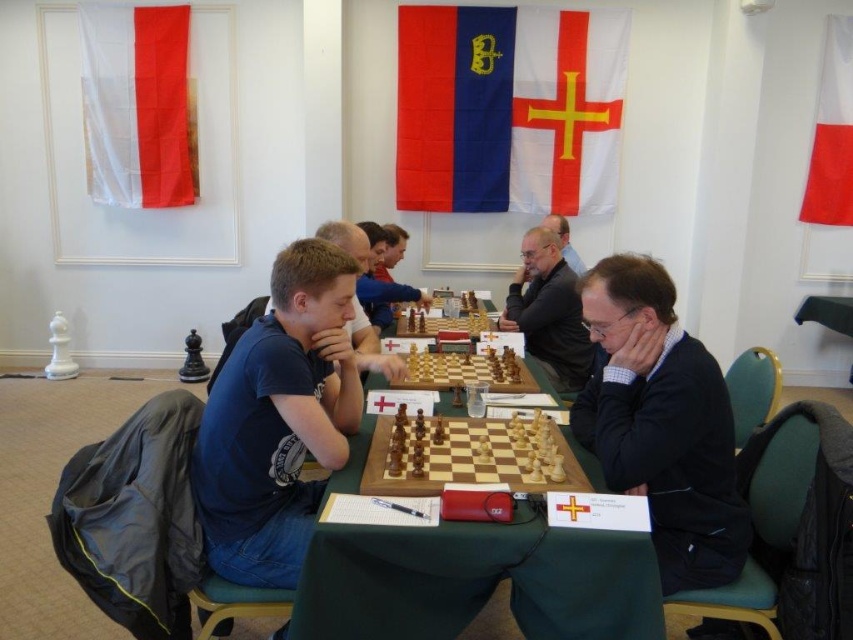
You are organizing a chess tournament and need to place a trophy on the table between the wooden at center and the wooden chessboard at center. Which object should the trophy be placed closer to if it needs to be centered between them?

The trophy should be placed closer to the wooden chessboard at center because the wooden at center is wider than the wooden chessboard at center, so the center point between them would be nearer to the narrower object.

Consider the image. You are a photographer positioned at the back of the room. You want to take a photo of both the black sweater at center and the blue cotton shirt at center without any obstruction. Which one should you focus on first to ensure both are in frame?

You should focus on the blue cotton shirt at center first because the black sweater at center is in front of it, so adjusting the frame to include both would require ensuring the background object is also visible.